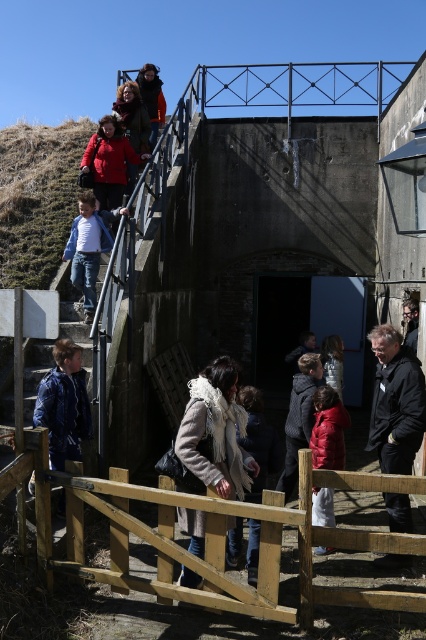
Which is in front, point (305, 381) or point (333, 385)?

Point (305, 381) is more forward.

In the scene shown: Which is above, dark gray wool coat at center or dark gray jacket at center?

dark gray jacket at center

This screenshot has width=426, height=640. What do you see at coordinates (299, 417) in the screenshot? I see `dark gray wool coat at center` at bounding box center [299, 417].

I want to click on dark gray wool coat at center, so click(x=299, y=417).

Between denim jacket at lower left and red matte jacket at lower center, which one has more height?

Standing taller between the two is red matte jacket at lower center.

Can you confirm if denim jacket at lower left is smaller than red matte jacket at lower center?

No.

Identify the location of denim jacket at lower left. This screenshot has width=426, height=640. click(x=63, y=404).

The height and width of the screenshot is (640, 426). I want to click on denim jacket at lower left, so click(63, 404).

Is red matte jacket at lower center further to camera compared to dark gray jacket at lower right?

No, it is not.

Is red matte jacket at lower center in front of dark gray jacket at lower right?

Yes, it is.

Image resolution: width=426 pixels, height=640 pixels. Find the location of `red matte jacket at lower center`. red matte jacket at lower center is located at coordinates pos(328,429).

I want to click on red matte jacket at lower center, so click(328, 429).